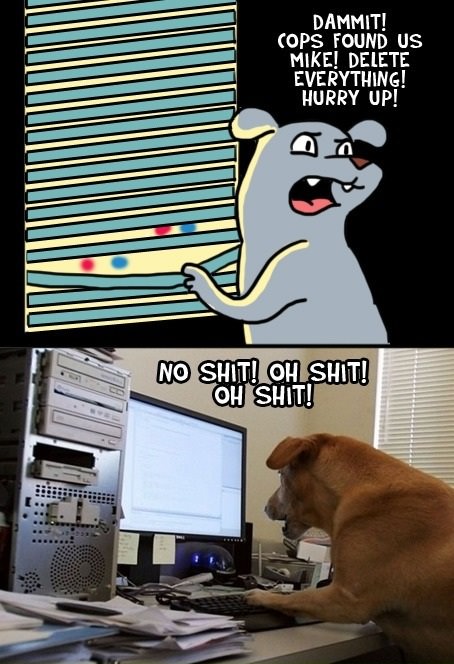
Locate an element on the screen. keyboard is located at coordinates (238, 602).